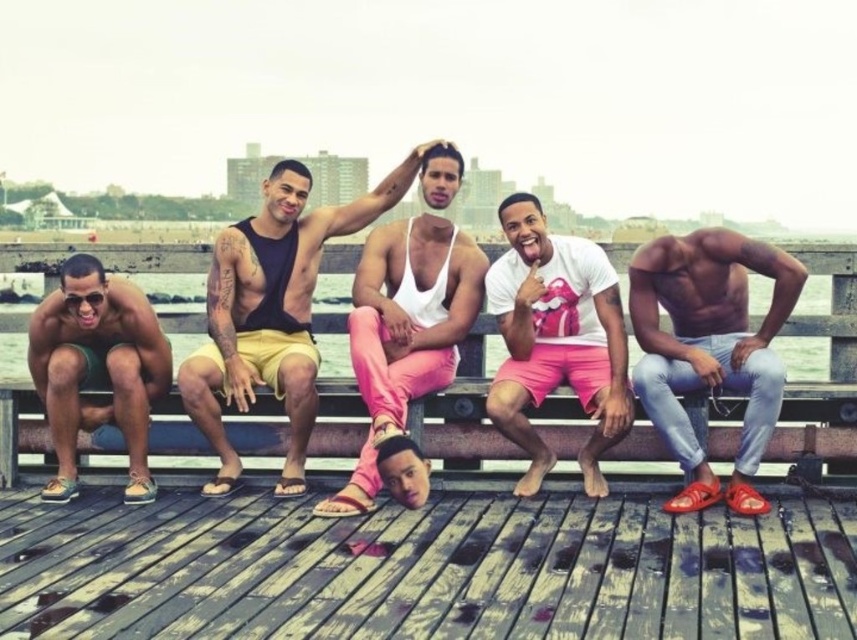
Between wooden bench at center and white matte tank top at center, which one has more height?

Standing taller between the two is wooden bench at center.

Which is below, wooden bench at center or white matte tank top at center?

wooden bench at center is lower down.

This screenshot has height=640, width=857. I want to click on wooden bench at center, so click(466, 412).

What are the coordinates of `wooden bench at center` in the screenshot? It's located at (466, 412).

Based on the photo, can you confirm if weathered wood dock at lower center is positioned to the right of white matte t-shirt at center?

In fact, weathered wood dock at lower center is to the left of white matte t-shirt at center.

Who is higher up, weathered wood dock at lower center or white matte t-shirt at center?

white matte t-shirt at center

Which is in front, point (838, 545) or point (616, 378)?

Positioned in front is point (838, 545).

At what (x,y) coordinates should I click in order to perform the action: click on weathered wood dock at lower center. Please return your answer as a coordinate pair (x, y). Image resolution: width=857 pixels, height=640 pixels. Looking at the image, I should click on pyautogui.click(x=423, y=570).

Can you confirm if weathered wood dock at lower center is taller than matte black tank top at center?

No.

The width and height of the screenshot is (857, 640). What do you see at coordinates (423, 570) in the screenshot? I see `weathered wood dock at lower center` at bounding box center [423, 570].

You are a GUI agent. You are given a task and a screenshot of the screen. Output one action in this format:
    pyautogui.click(x=<x>, y=<y>)
    Task: Click on the weathered wood dock at lower center
    The height and width of the screenshot is (640, 857).
    Given the screenshot: What is the action you would take?
    pyautogui.click(x=423, y=570)